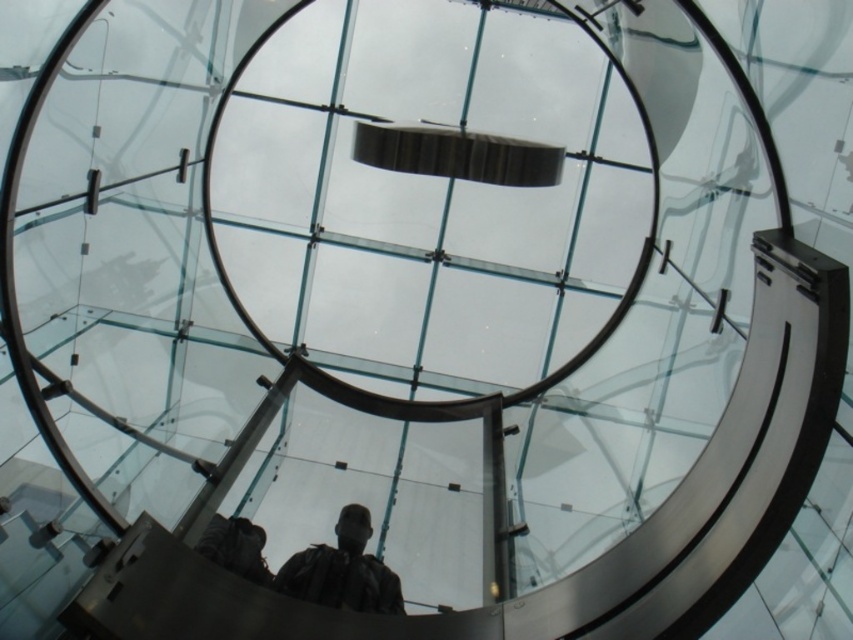
Can you confirm if dark brown leather jacket at lower center is taller than dark gray jacket at lower center?

Indeed, dark brown leather jacket at lower center has a greater height compared to dark gray jacket at lower center.

Is the position of dark brown leather jacket at lower center less distant than that of dark gray jacket at lower center?

Yes, dark brown leather jacket at lower center is closer to the viewer.

Measure the distance between dark brown leather jacket at lower center and camera.

A distance of 18.33 meters exists between dark brown leather jacket at lower center and camera.

The height and width of the screenshot is (640, 853). Find the location of `dark brown leather jacket at lower center`. dark brown leather jacket at lower center is located at coordinates (341, 570).